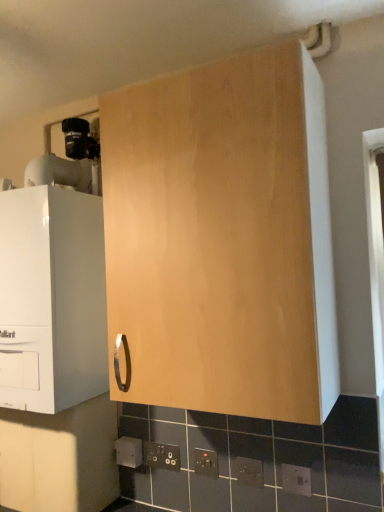
Measure the distance between point (250, 483) and camera.

They are 1.34 meters apart.

This screenshot has width=384, height=512. What do you see at coordinates (206, 463) in the screenshot? I see `black plastic electric outlet at lower center, acting as the 3th electric outlet starting from the front` at bounding box center [206, 463].

The width and height of the screenshot is (384, 512). What do you see at coordinates (161, 456) in the screenshot?
I see `matte black socket at lower center, the second electric outlet positioned from the left` at bounding box center [161, 456].

Describe the element at coordinates (296, 479) in the screenshot. This screenshot has width=384, height=512. I see `matte black electric outlet at lower center, which ranks as the 1th electric outlet in front-to-back order` at that location.

The image size is (384, 512). Describe the element at coordinates (223, 238) in the screenshot. I see `light wood cabinet at center, acting as the 3th cabinetry starting from the left` at that location.

Describe the element at coordinates (52, 298) in the screenshot. I see `matte white boiler at left, arranged as the 1th cabinetry when viewed from the left` at that location.

Image resolution: width=384 pixels, height=512 pixels. What are the coordinates of `white plastic electric outlet at lower center, which appears as the first electric outlet when viewed from the left` in the screenshot? It's located at (129, 452).

Is matte black socket at lower center, the second electric outlet positioned from the left, inside matte black electric outlet at lower center, which ranks as the 1th electric outlet in front-to-back order?

No.

Can you confirm if matte black electric outlet at lower center, which ranks as the 1th electric outlet in front-to-back order, is bigger than matte black socket at lower center, acting as the second electric outlet starting from the back?

Actually, matte black electric outlet at lower center, which ranks as the 1th electric outlet in front-to-back order, might be smaller than matte black socket at lower center, acting as the second electric outlet starting from the back.

Which is more to the left, matte black electric outlet at lower center, arranged as the fifth electric outlet when viewed from the left, or matte black socket at lower center, the second electric outlet positioned from the left?

Positioned to the left is matte black socket at lower center, the second electric outlet positioned from the left.

How many degrees apart are the facing directions of matte black electric outlet at lower center, which ranks as the 1th electric outlet in front-to-back order, and matte black socket at lower center, the second electric outlet positioned from the left?

0.00304 degrees separate the facing orientations of matte black electric outlet at lower center, which ranks as the 1th electric outlet in front-to-back order, and matte black socket at lower center, the second electric outlet positioned from the left.

From the image's perspective, relative to black plastic electric outlet at lower center, positioned as the third electric outlet in back-to-front order, is matte black electric outlet at lower center, arranged as the fifth electric outlet when viewed from the left, above or below?

matte black electric outlet at lower center, arranged as the fifth electric outlet when viewed from the left, is situated higher than black plastic electric outlet at lower center, positioned as the third electric outlet in back-to-front order, in the image.

Does matte black electric outlet at lower center, positioned as the first electric outlet in right-to-left order, have a larger size compared to black plastic electric outlet at lower center, positioned as the third electric outlet in back-to-front order?

Incorrect, matte black electric outlet at lower center, positioned as the first electric outlet in right-to-left order, is not larger than black plastic electric outlet at lower center, positioned as the third electric outlet in back-to-front order.

Is matte black electric outlet at lower center, which ranks as the 1th electric outlet in front-to-back order, spatially inside black plastic electric outlet at lower center, which ranks as the 3th electric outlet in right-to-left order, or outside of it?

matte black electric outlet at lower center, which ranks as the 1th electric outlet in front-to-back order, is not inside black plastic electric outlet at lower center, which ranks as the 3th electric outlet in right-to-left order, it's outside.

Is matte black electric outlet at lower center, the fifth electric outlet in the back-to-front sequence, wider or thinner than black plastic electric outlet at lower center, acting as the 3th electric outlet starting from the front?

matte black electric outlet at lower center, the fifth electric outlet in the back-to-front sequence, is thinner than black plastic electric outlet at lower center, acting as the 3th electric outlet starting from the front.

In the scene shown: Based on their sizes in the image, would you say matte black electric outlet at lower center, arranged as the fifth electric outlet when viewed from the left, is bigger or smaller than black plastic/socket at lower center, marked as the 2th electric outlet in a right-to-left arrangement?

In the image, matte black electric outlet at lower center, arranged as the fifth electric outlet when viewed from the left, appears to be larger than black plastic/socket at lower center, marked as the 2th electric outlet in a right-to-left arrangement.

From a real-world perspective, is matte black electric outlet at lower center, positioned as the first electric outlet in right-to-left order, physically above black plastic/socket at lower center, marked as the 2th electric outlet in a right-to-left arrangement?

No, from a real-world perspective, matte black electric outlet at lower center, positioned as the first electric outlet in right-to-left order, is not above black plastic/socket at lower center, marked as the 2th electric outlet in a right-to-left arrangement.

Which of these two, matte black electric outlet at lower center, positioned as the first electric outlet in right-to-left order, or black plastic/socket at lower center, placed as the 2th electric outlet when sorted from front to back, is thinner?

black plastic/socket at lower center, placed as the 2th electric outlet when sorted from front to back, is thinner.

Considering the sizes of objects light wood cabinet at center, which is the 1th cabinetry in right-to-left order, and matte wood cabinet at lower left, which is counted as the 2th cabinetry, starting from the left, in the image provided, who is shorter, light wood cabinet at center, which is the 1th cabinetry in right-to-left order, or matte wood cabinet at lower left, which is counted as the 2th cabinetry, starting from the left,?

With less height is matte wood cabinet at lower left, which is counted as the 2th cabinetry, starting from the left.

Where is `the 2nd cabinetry behind the light wood cabinet at center, which is the 1th cabinetry in right-to-left order, starting your count from the anchor`? This screenshot has width=384, height=512. the 2nd cabinetry behind the light wood cabinet at center, which is the 1th cabinetry in right-to-left order, starting your count from the anchor is located at coordinates (59, 458).

Would you say light wood cabinet at center, acting as the 3th cabinetry starting from the left, is a long distance from matte wood cabinet at lower left, positioned as the second cabinetry in right-to-left order?

They are positioned close to each other.

Between light wood cabinet at center, which is the 1th cabinetry in right-to-left order, and matte wood cabinet at lower left, which is counted as the 2th cabinetry, starting from the left, which one appears on the right side from the viewer's perspective?

light wood cabinet at center, which is the 1th cabinetry in right-to-left order.

Considering the relative sizes of matte black electric outlet at lower center, arranged as the fifth electric outlet when viewed from the left, and matte wood cabinet at lower left, positioned as the second cabinetry in right-to-left order, in the image provided, is matte black electric outlet at lower center, arranged as the fifth electric outlet when viewed from the left, shorter than matte wood cabinet at lower left, positioned as the second cabinetry in right-to-left order,?

Yes.

Is matte black electric outlet at lower center, arranged as the fifth electric outlet when viewed from the left, outside of matte wood cabinet at lower left, positioned as the second cabinetry in right-to-left order?

Absolutely, matte black electric outlet at lower center, arranged as the fifth electric outlet when viewed from the left, is external to matte wood cabinet at lower left, positioned as the second cabinetry in right-to-left order.

From a real-world perspective, between matte black electric outlet at lower center, arranged as the fifth electric outlet when viewed from the left, and matte wood cabinet at lower left, which is counted as the 2th cabinetry, starting from the left, who is vertically lower?

matte black electric outlet at lower center, arranged as the fifth electric outlet when viewed from the left, is physically lower.

What's the angular difference between matte black electric outlet at lower center, arranged as the fifth electric outlet when viewed from the left, and matte wood cabinet at lower left, positioned as the second cabinetry in right-to-left order,'s facing directions?

There is a 0.00619-degree angle between the facing directions of matte black electric outlet at lower center, arranged as the fifth electric outlet when viewed from the left, and matte wood cabinet at lower left, positioned as the second cabinetry in right-to-left order.

From the image's perspective, is black plastic electric outlet at lower center, which ranks as the 3th electric outlet in right-to-left order, located beneath black plastic/socket at lower center, marked as the 2th electric outlet in a right-to-left arrangement?

Yes.

Between black plastic electric outlet at lower center, which ranks as the 3th electric outlet in right-to-left order, and black plastic/socket at lower center, which ranks as the 4th electric outlet in back-to-front order, which one appears on the left side from the viewer's perspective?

black plastic electric outlet at lower center, which ranks as the 3th electric outlet in right-to-left order, is more to the left.

Where is `the 1st electric outlet above when counting from the black plastic electric outlet at lower center, marked as the 3th electric outlet in a left-to-right arrangement (from the image's perspective)`? Image resolution: width=384 pixels, height=512 pixels. the 1st electric outlet above when counting from the black plastic electric outlet at lower center, marked as the 3th electric outlet in a left-to-right arrangement (from the image's perspective) is located at coordinates [249, 472].

Which object is more forward, black plastic electric outlet at lower center, acting as the 3th electric outlet starting from the front, or matte black socket at lower center, acting as the second electric outlet starting from the back?

Positioned in front is black plastic electric outlet at lower center, acting as the 3th electric outlet starting from the front.

Between black plastic electric outlet at lower center, acting as the 3th electric outlet starting from the front, and matte black socket at lower center, the second electric outlet positioned from the left, which one appears on the left side from the viewer's perspective?

matte black socket at lower center, the second electric outlet positioned from the left, is more to the left.

Could you tell me if black plastic electric outlet at lower center, acting as the 3th electric outlet starting from the front, is turned towards matte black socket at lower center, the second electric outlet positioned from the left?

No, black plastic electric outlet at lower center, acting as the 3th electric outlet starting from the front, is not turned towards matte black socket at lower center, the second electric outlet positioned from the left.

Considering the relative sizes of black plastic electric outlet at lower center, marked as the 3th electric outlet in a left-to-right arrangement, and matte black socket at lower center, acting as the second electric outlet starting from the back, in the image provided, is black plastic electric outlet at lower center, marked as the 3th electric outlet in a left-to-right arrangement, shorter than matte black socket at lower center, acting as the second electric outlet starting from the back,?

Incorrect, the height of black plastic electric outlet at lower center, marked as the 3th electric outlet in a left-to-right arrangement, does not fall short of that of matte black socket at lower center, acting as the second electric outlet starting from the back.

At what (x,y) coordinates should I click in order to perform the action: click on electric outlet that is the 3rd one when counting leftward from the matte black electric outlet at lower center, positioned as the first electric outlet in right-to-left order. Please return your answer as a coordinate pair (x, y). The width and height of the screenshot is (384, 512). Looking at the image, I should click on (161, 456).

You are a GUI agent. You are given a task and a screenshot of the screen. Output one action in this format:
    pyautogui.click(x=<x>, y=<y>)
    Task: Click on the 2nd electric outlet to the right of the black plastic electric outlet at lower center, acting as the 3th electric outlet starting from the front, starting your count from the anchor
    
    Given the screenshot: What is the action you would take?
    pyautogui.click(x=296, y=479)

Based on the photo, when comparing their distances from light wood cabinet at center, acting as the 3th cabinetry starting from the left, does matte black socket at lower center, the 4th electric outlet in the front-to-back sequence, or matte wood cabinet at lower left, which is counted as the 2th cabinetry, starting from the left, seem further?

matte black socket at lower center, the 4th electric outlet in the front-to-back sequence, is positioned further to the anchor light wood cabinet at center, acting as the 3th cabinetry starting from the left.

Based on the photo, estimate the real-world distances between objects in this image. Which object is further from matte wood cabinet at lower left, which is counted as the 2th cabinetry, starting from the left, white plastic electric outlet at lower center, the first electric outlet in the back-to-front sequence, or light wood cabinet at center, acting as the 3th cabinetry starting from the left?

light wood cabinet at center, acting as the 3th cabinetry starting from the left.

Looking at the image, which one is located further to white plastic electric outlet at lower center, which is counted as the 5th electric outlet, starting from the front, matte black socket at lower center, acting as the second electric outlet starting from the back, or matte wood cabinet at lower left, positioned as the second cabinetry in right-to-left order?

matte wood cabinet at lower left, positioned as the second cabinetry in right-to-left order, lies further to white plastic electric outlet at lower center, which is counted as the 5th electric outlet, starting from the front, than the other object.

Considering their positions, is white plastic electric outlet at lower center, which appears as the first electric outlet when viewed from the left, positioned further to black plastic/socket at lower center, marked as the 2th electric outlet in a right-to-left arrangement, than matte black electric outlet at lower center, positioned as the first electric outlet in right-to-left order?

white plastic electric outlet at lower center, which appears as the first electric outlet when viewed from the left.

Which object lies nearer to the anchor point light wood cabinet at center, which is the 1th cabinetry in right-to-left order, black plastic/socket at lower center, which ranks as the fourth electric outlet in left-to-right order, or matte black electric outlet at lower center, which ranks as the 1th electric outlet in front-to-back order?

Among the two, black plastic/socket at lower center, which ranks as the fourth electric outlet in left-to-right order, is located nearer to light wood cabinet at center, which is the 1th cabinetry in right-to-left order.

Which object lies nearer to the anchor point matte white boiler at left, which is counted as the third cabinetry, starting from the right, black plastic/socket at lower center, which ranks as the 4th electric outlet in back-to-front order, or white plastic electric outlet at lower center, which is counted as the 5th electric outlet, starting from the front?

white plastic electric outlet at lower center, which is counted as the 5th electric outlet, starting from the front, lies closer to matte white boiler at left, which is counted as the third cabinetry, starting from the right, than the other object.

From the image, which object appears to be nearer to black plastic electric outlet at lower center, acting as the 3th electric outlet starting from the front, black plastic/socket at lower center, which ranks as the fourth electric outlet in left-to-right order, or matte white boiler at left, arranged as the 1th cabinetry when viewed from the left?

Based on the image, black plastic/socket at lower center, which ranks as the fourth electric outlet in left-to-right order, appears to be nearer to black plastic electric outlet at lower center, acting as the 3th electric outlet starting from the front.

From the image, which object appears to be farther from black plastic/socket at lower center, marked as the 2th electric outlet in a right-to-left arrangement, light wood cabinet at center, acting as the 3th cabinetry starting from the left, or matte black socket at lower center, which is the 4th electric outlet from right to left?

Based on the image, light wood cabinet at center, acting as the 3th cabinetry starting from the left, appears to be further to black plastic/socket at lower center, marked as the 2th electric outlet in a right-to-left arrangement.

The width and height of the screenshot is (384, 512). In order to click on electric outlet between matte wood cabinet at lower left, which is counted as the 2th cabinetry, starting from the left, and matte black socket at lower center, the 4th electric outlet in the front-to-back sequence, in the horizontal direction in this screenshot , I will do `click(129, 452)`.

Locate an element on the screen. electric outlet between matte black socket at lower center, which is the 4th electric outlet from right to left, and black plastic/socket at lower center, placed as the 2th electric outlet when sorted from front to back, from left to right is located at coordinates (206, 463).

Where is `cabinetry between light wood cabinet at center, acting as the 3th cabinetry starting from the left, and matte wood cabinet at lower left, which is counted as the 2th cabinetry, starting from the left, in the vertical direction`? cabinetry between light wood cabinet at center, acting as the 3th cabinetry starting from the left, and matte wood cabinet at lower left, which is counted as the 2th cabinetry, starting from the left, in the vertical direction is located at coordinates (52, 298).

Locate an element on the screen. This screenshot has height=512, width=384. cabinetry between light wood cabinet at center, which is the 1th cabinetry in right-to-left order, and black plastic/socket at lower center, placed as the 2th electric outlet when sorted from front to back, from top to bottom is located at coordinates (52, 298).